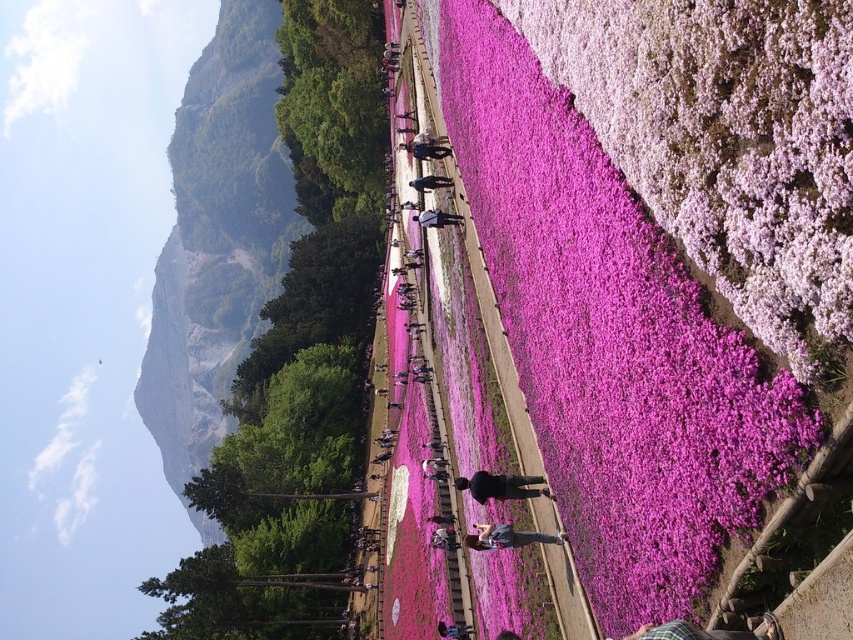
You are standing at the point marked as point (608, 324) in the image. Looking around, you see pink fluffy petals at center. What is directly beneath your feet?

The point marked as point (608, 324) is where the pink fluffy petals at center are located, so the pink fluffy petals at center are directly beneath your feet.

You are standing on the pathway and looking towards the pink fluffy petals at center and the green leafy hillside at upper left. Which object appears closer to you?

The pink fluffy petals at center appears closer to you because it has a lesser height compared to the green leafy hillside at upper left.

You are standing on the walkway and notice the pink fluffy petals at center and the green leafy hillside at upper left. Which object is positioned to the right side of the other?

The pink fluffy petals at center is to the right of green leafy hillside at upper left.